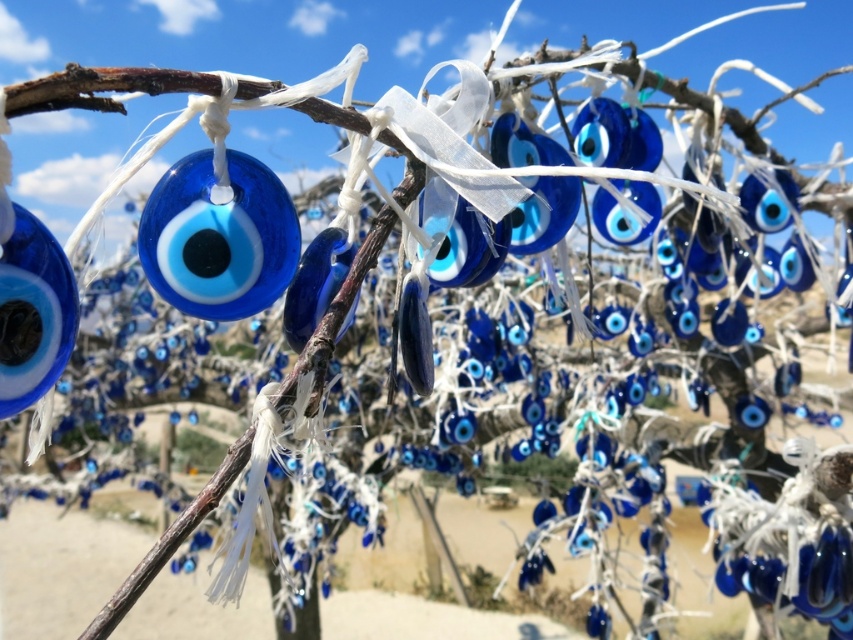
Is glossy glass eye at center below matte glass eye at center?

Correct, glossy glass eye at center is located below matte glass eye at center.

Is glossy glass eye at center wider than matte glass eye at center?

Indeed, glossy glass eye at center has a greater width compared to matte glass eye at center.

Is point (230, 305) farther from camera compared to point (576, 195)?

No.

Locate an element on the screen. The height and width of the screenshot is (640, 853). glossy glass eye at center is located at coordinates (218, 237).

Does point (42, 262) come farther from viewer compared to point (498, 163)?

That is False.

Is blue glass bead at left to the left of matte glass eye at center from the viewer's perspective?

Indeed, blue glass bead at left is positioned on the left side of matte glass eye at center.

Identify the location of blue glass bead at left. The width and height of the screenshot is (853, 640). (33, 314).

Does glossy glass eye at center appear on the left side of blue glass bead at left?

In fact, glossy glass eye at center is to the right of blue glass bead at left.

Is glossy glass eye at center thinner than blue glass bead at left?

Incorrect, glossy glass eye at center's width is not less than blue glass bead at left's.

Is point (141, 248) less distant than point (45, 365)?

No, it is not.

What are the coordinates of `glossy glass eye at center` in the screenshot? It's located at (218, 237).